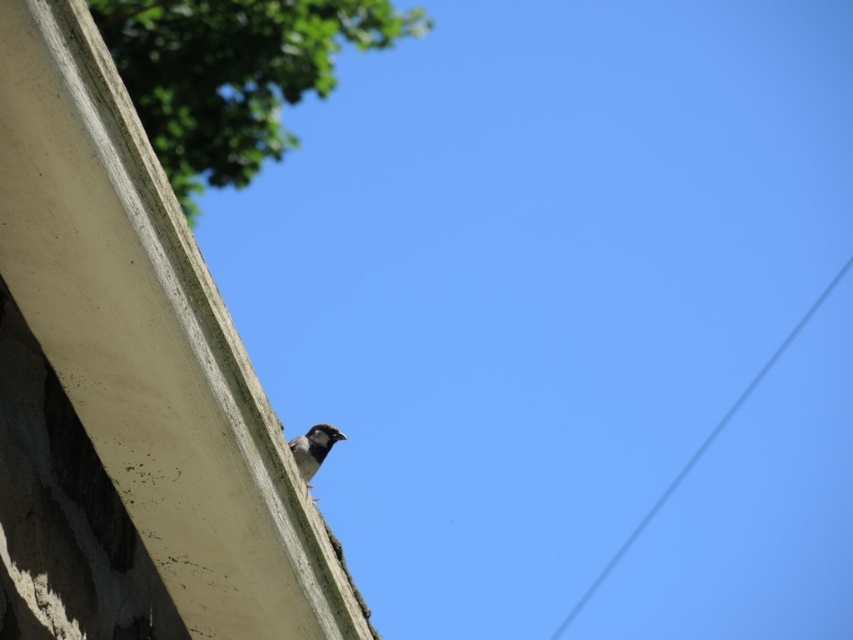
Question: Which point is closer to the camera?

Choices:
 (A) green leafy tree at upper left
 (B) gray wire at upper right

Answer: (A)

Question: Is gray wire at upper right further to the viewer compared to dark gray matte sparrow at upper center?

Choices:
 (A) no
 (B) yes

Answer: (B)

Question: Does gray wire at upper right appear under dark gray matte sparrow at upper center?

Choices:
 (A) no
 (B) yes

Answer: (B)

Question: Which of the following is the farthest from the observer?

Choices:
 (A) (567, 616)
 (B) (223, 54)
 (C) (320, 433)

Answer: (A)

Question: Which point is farther to the camera?

Choices:
 (A) green leafy tree at upper left
 (B) dark gray matte sparrow at upper center
 (C) gray wire at upper right

Answer: (C)

Question: Can you confirm if green leafy tree at upper left is thinner than gray wire at upper right?

Choices:
 (A) yes
 (B) no

Answer: (A)